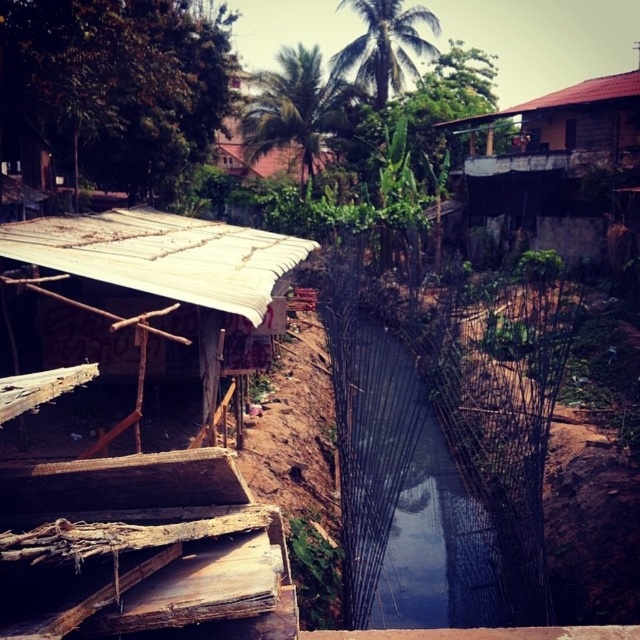
Is point (560, 182) positioned in front of point (282, 68)?

Yes, it is.

Is brown wooden hut at upper right taller than brown wooden hut at upper center?

No, brown wooden hut at upper right is not taller than brown wooden hut at upper center.

You are a GUI agent. You are given a task and a screenshot of the screen. Output one action in this format:
    pyautogui.click(x=<x>, y=<y>)
    Task: Click on the brown wooden hut at upper right
    The width and height of the screenshot is (640, 640).
    Given the screenshot: What is the action you would take?
    pyautogui.click(x=556, y=164)

Does transparent plastic water at center lie behind natural bamboo hut at left?

That is True.

Can you confirm if transparent plastic water at center is positioned to the right of natural bamboo hut at left?

Correct, you'll find transparent plastic water at center to the right of natural bamboo hut at left.

Which is behind, point (426, 532) or point (195, 259)?

The point (426, 532) is behind.

Where is `transparent plastic water at center`? This screenshot has height=640, width=640. transparent plastic water at center is located at coordinates (412, 492).

Who is taller, natural bamboo hut at left or brown wooden hut at upper center?

brown wooden hut at upper center

Can you confirm if natural bamboo hut at left is positioned below brown wooden hut at upper center?

Indeed, natural bamboo hut at left is positioned under brown wooden hut at upper center.

At what (x,y) coordinates should I click in order to perform the action: click on natural bamboo hut at left. Please return your answer as a coordinate pair (x, y). The height and width of the screenshot is (640, 640). Looking at the image, I should click on (163, 256).

The width and height of the screenshot is (640, 640). What are the coordinates of `natural bamboo hut at left` in the screenshot? It's located at (163, 256).